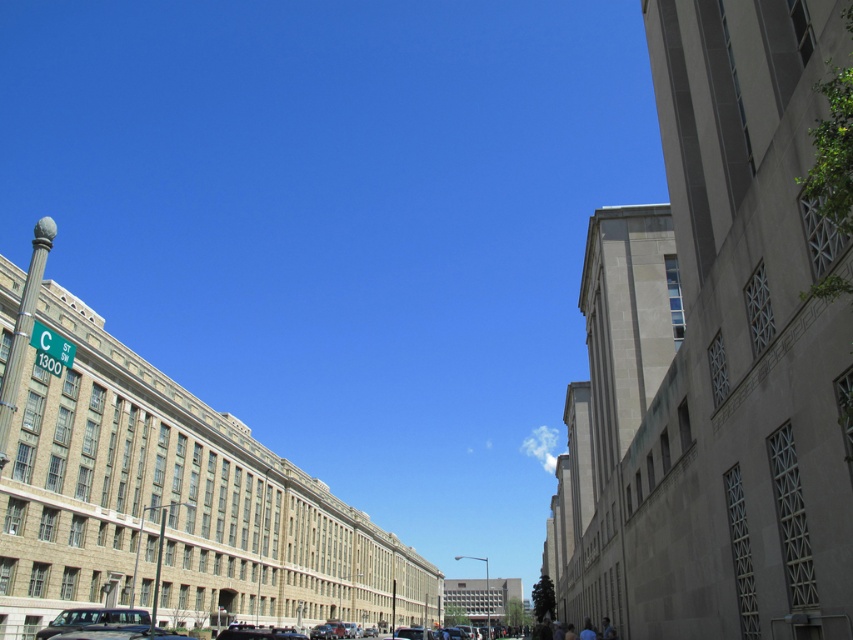
Question: Is light brown hair at lower right positioned before blue fabric shirt at lower right?

Choices:
 (A) no
 (B) yes

Answer: (A)

Question: Is metallic silver van at lower center smaller than blue fabric shirt at lower right?

Choices:
 (A) no
 (B) yes

Answer: (A)

Question: Which point appears closest to the camera in this image?

Choices:
 (A) (579, 634)
 (B) (115, 612)
 (C) (610, 630)

Answer: (B)

Question: Does metallic silver van at lower center have a lesser width compared to blue fabric shirt at lower right?

Choices:
 (A) yes
 (B) no

Answer: (B)

Question: Among these points, which one is nearest to the camera?

Choices:
 (A) (606, 632)
 (B) (592, 636)
 (C) (160, 636)

Answer: (C)

Question: Which object appears closest to the camera in this image?

Choices:
 (A) light brown hair at lower right
 (B) metallic silver van at lower center

Answer: (B)